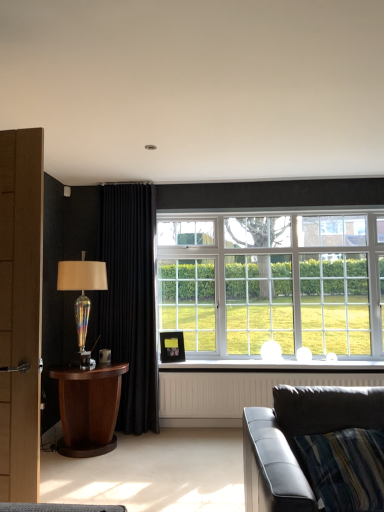
At what (x,y) coordinates should I click in order to perform the action: click on free space above black velvet curtain at left (from a real-world perspective). Please return your answer as a coordinate pair (x, y). This screenshot has width=384, height=512. Looking at the image, I should click on (132, 178).